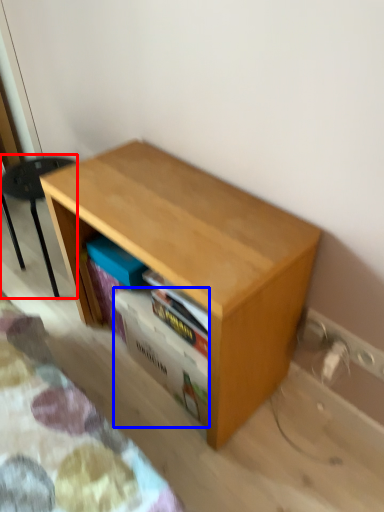
Question: Which of the following is the farthest to the observer, furniture (highlighted by a red box) or shelf (highlighted by a blue box)?

Choices:
 (A) furniture
 (B) shelf

Answer: (A)